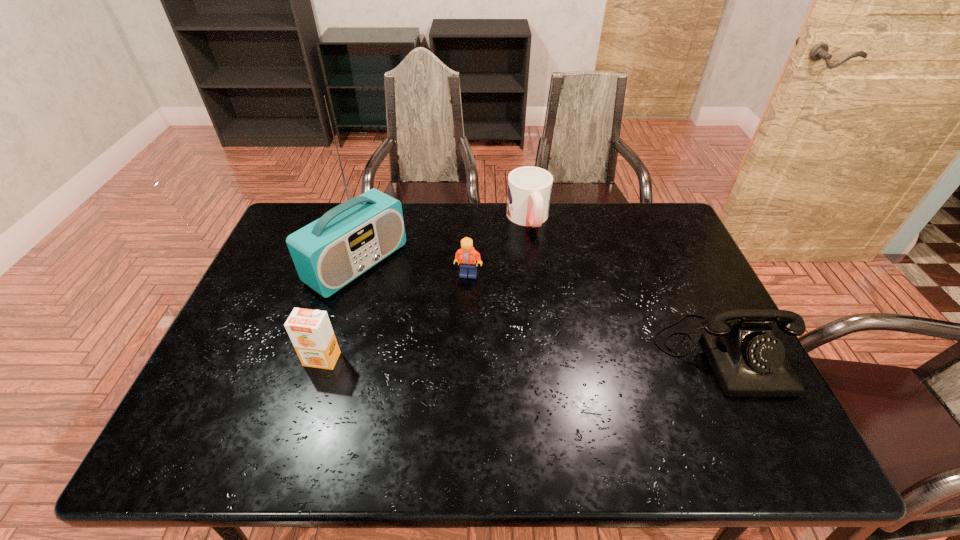
Locate an element on the screen. The image size is (960, 540). free space located on the front-facing side of the Lego is located at coordinates (497, 368).

The image size is (960, 540). I want to click on free region located on the front-facing side of the Lego, so click(x=502, y=385).

Identify the location of vacant space situated on the side of the mug with the handle. The width and height of the screenshot is (960, 540). (555, 292).

The height and width of the screenshot is (540, 960). I want to click on free space located 0.290m on the side of the mug with the handle, so click(x=559, y=302).

Where is `vacant space located 0.390m on the side of the mug with the handle`? vacant space located 0.390m on the side of the mug with the handle is located at coordinates (569, 329).

Image resolution: width=960 pixels, height=540 pixels. In order to click on radio receiver that is at the far edge in this screenshot , I will do `click(349, 239)`.

At what (x,y) coordinates should I click in order to perform the action: click on mug that is at the far edge. Please return your answer as a coordinate pair (x, y). This screenshot has height=540, width=960. Looking at the image, I should click on (529, 191).

Image resolution: width=960 pixels, height=540 pixels. Find the location of `object positioned at the near edge`. object positioned at the near edge is located at coordinates (748, 361).

I want to click on object that is positioned at the left edge, so click(x=349, y=239).

You are a GUI agent. You are given a task and a screenshot of the screen. Output one action in this format:
    pyautogui.click(x=<x>, y=<y>)
    Task: Click on the object at the right edge
    The height and width of the screenshot is (540, 960).
    Given the screenshot: What is the action you would take?
    pyautogui.click(x=748, y=361)